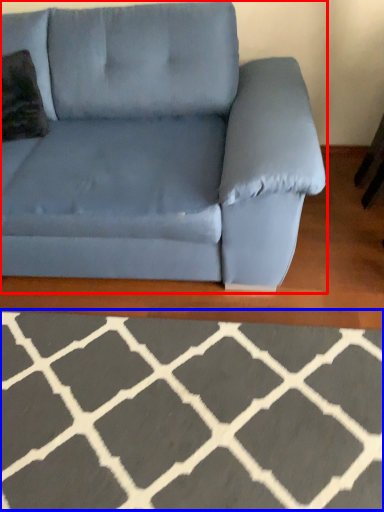
Question: Which of the following is the closest to the observer, studio couch (highlighted by a red box) or furniture (highlighted by a blue box)?

Choices:
 (A) studio couch
 (B) furniture

Answer: (B)